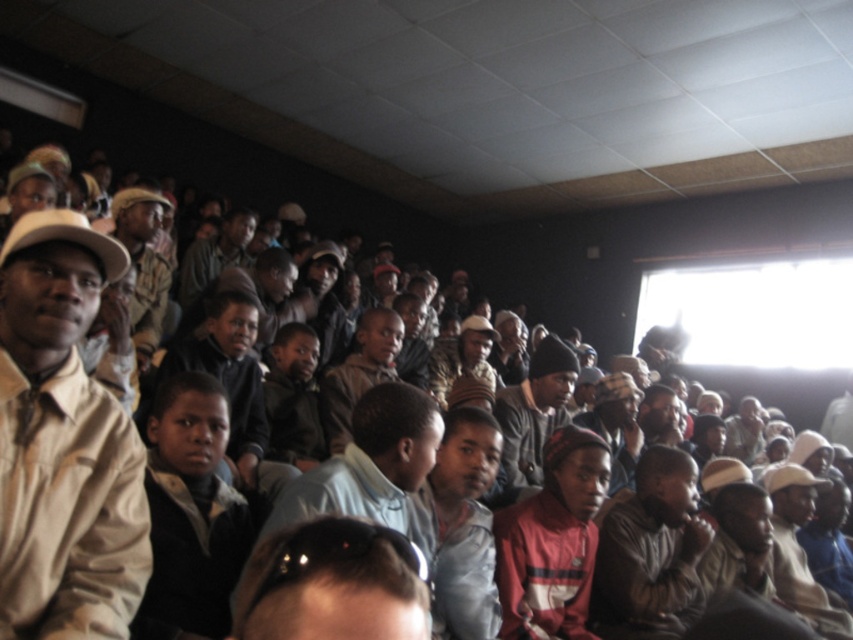
How far apart are black fabric jacket at center and red knit cap at center?

The distance of black fabric jacket at center from red knit cap at center is 85.67 centimeters.

Who is more distant from viewer, (248, 525) or (544, 637)?

Point (544, 637)

Image resolution: width=853 pixels, height=640 pixels. Find the location of `black fabric jacket at center`. black fabric jacket at center is located at coordinates (190, 513).

Is point (511, 419) closer to camera compared to point (375, 356)?

Yes, point (511, 419) is closer to viewer.

Which is more to the left, dark gray knit cap at center or light brown leather jacket at center?

Positioned to the left is light brown leather jacket at center.

In the scene shown: Measure the distance between point (x=527, y=492) and camera.

They are 8.93 feet apart.

You are a GUI agent. You are given a task and a screenshot of the screen. Output one action in this format:
    pyautogui.click(x=<x>, y=<y>)
    Task: Click on the dark gray knit cap at center
    The width and height of the screenshot is (853, 640).
    Given the screenshot: What is the action you would take?
    pyautogui.click(x=534, y=412)

Is black fabric jacket at center smaller than light brown leather jacket at center?

Correct, black fabric jacket at center occupies less space than light brown leather jacket at center.

Which of these two, black fabric jacket at center or light brown leather jacket at center, stands shorter?

light brown leather jacket at center is shorter.

Where is `black fabric jacket at center`? The image size is (853, 640). black fabric jacket at center is located at coordinates (190, 513).

This screenshot has height=640, width=853. In order to click on black fabric jacket at center in this screenshot , I will do `click(190, 513)`.